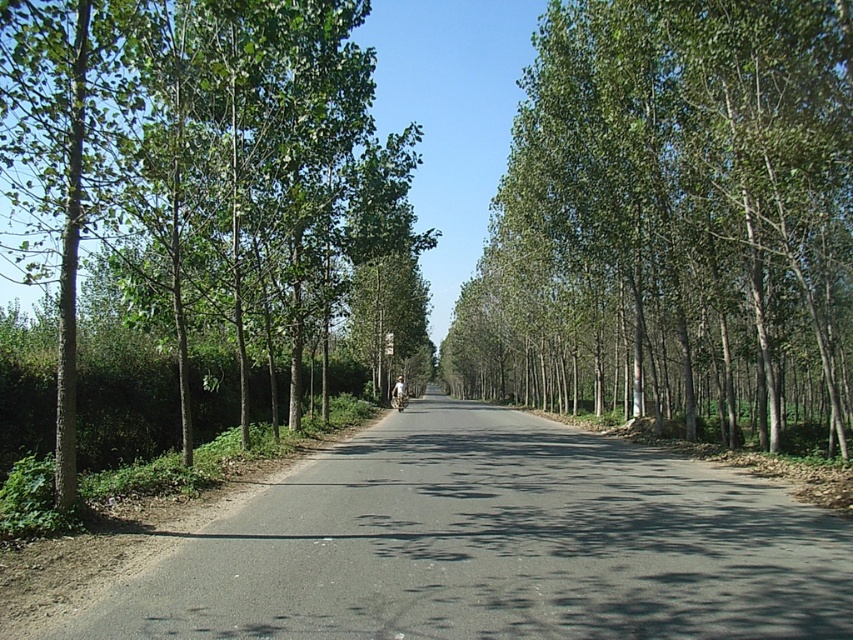
Question: Observing the image, what is the correct spatial positioning of green leafy tree at center in reference to green leafy tree at left?

Choices:
 (A) left
 (B) right

Answer: (B)

Question: Where is green leafy tree at center located in relation to green leafy tree at left in the image?

Choices:
 (A) below
 (B) above

Answer: (A)

Question: Among these objects, which one is farthest from the camera?

Choices:
 (A) green leafy tree at center
 (B) green leafy tree at left

Answer: (A)

Question: Which point is farther to the camera?

Choices:
 (A) (624, 80)
 (B) (138, 83)

Answer: (A)

Question: Can you confirm if green leafy tree at center is positioned above green leafy tree at left?

Choices:
 (A) no
 (B) yes

Answer: (A)